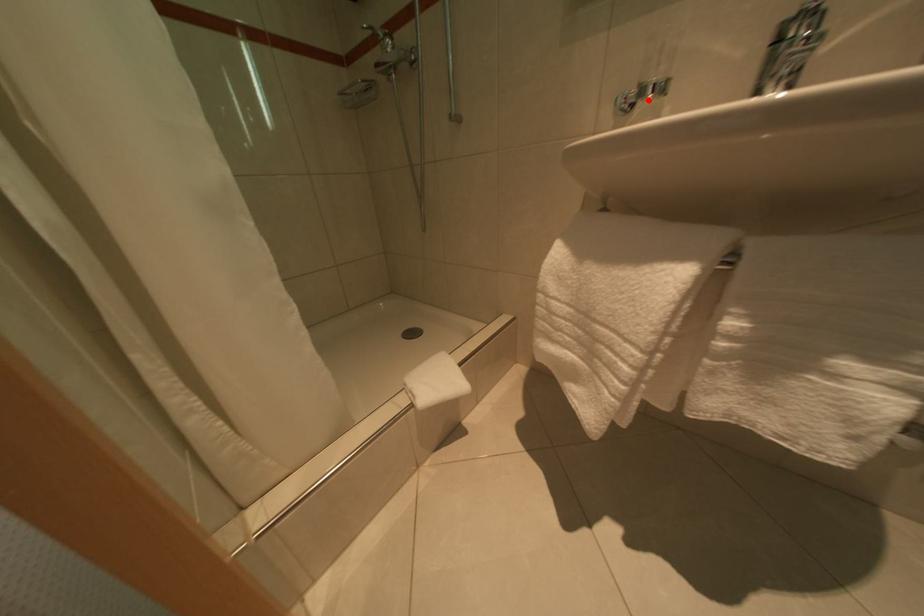
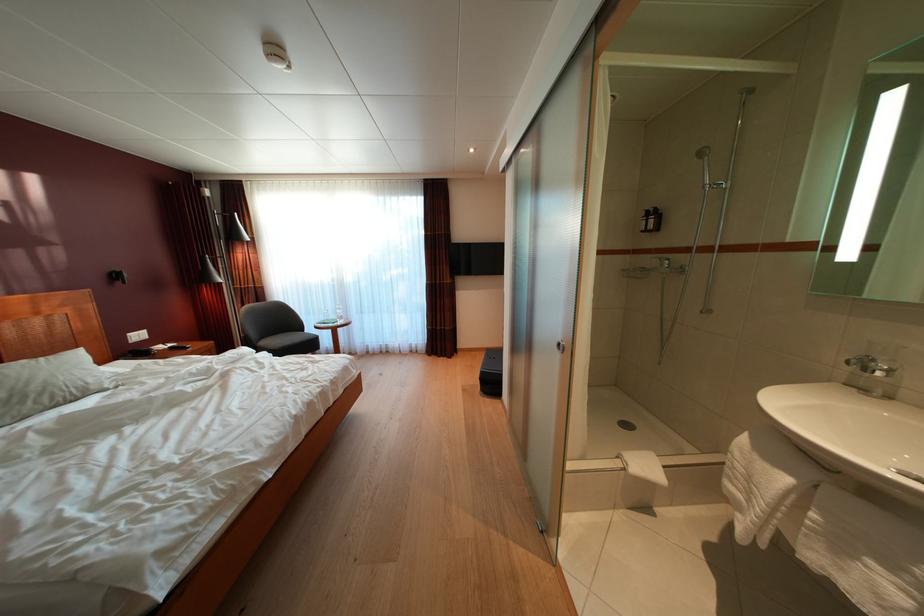
Locate, in the second image, the point that corresponds to the highlighted location in the first image.

(871, 376)